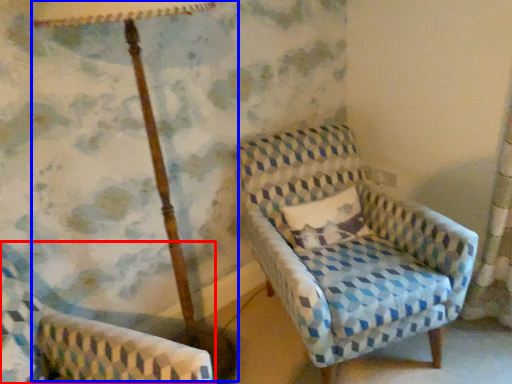
Question: Which of the following is the farthest to the observer, chair (highlighted by a red box) or table lamp (highlighted by a blue box)?

Choices:
 (A) chair
 (B) table lamp

Answer: (B)